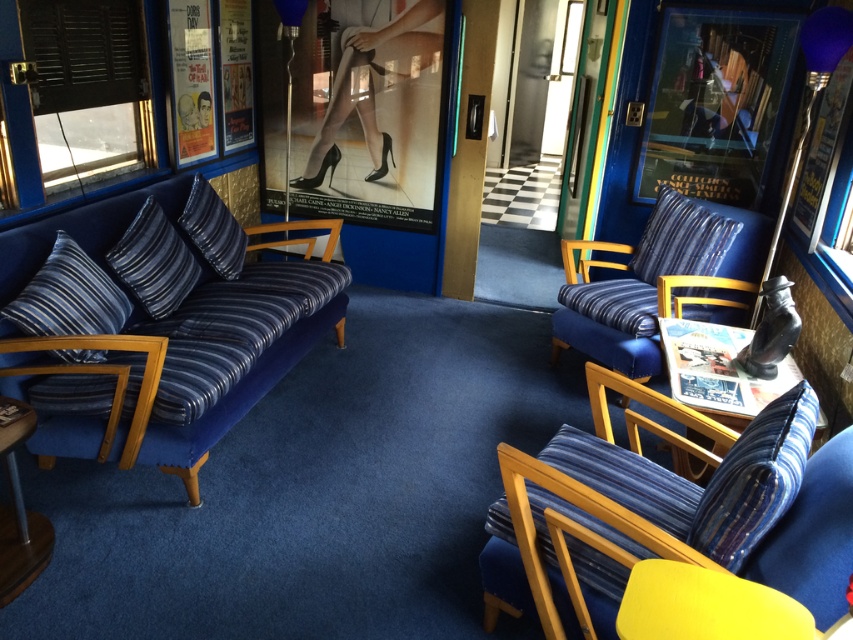
Question: Does blue striped pillow at left appear over blue striped pillow at center?

Choices:
 (A) yes
 (B) no

Answer: (B)

Question: Does silky blue pillow at left have a lesser width compared to blue striped pillow at center?

Choices:
 (A) yes
 (B) no

Answer: (A)

Question: Which point is closer to the camera?

Choices:
 (A) blue striped pillow at center
 (B) blue striped pillow at left

Answer: (B)

Question: Does wooden table at lower left appear under blue striped pillow at center?

Choices:
 (A) no
 (B) yes

Answer: (B)

Question: Among these points, which one is nearest to the camera?

Choices:
 (A) (743, 440)
 (B) (664, 346)
 (C) (630, 317)
 (D) (241, 250)

Answer: (A)

Question: Which object is farther from the camera taking this photo?

Choices:
 (A) wooden table at lower left
 (B) matte blue fabric chair at right
 (C) wooden glossy table at right

Answer: (C)